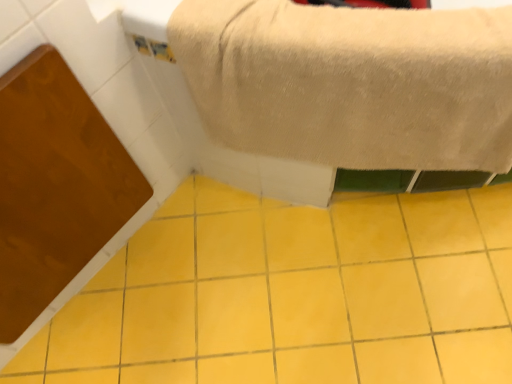
The width and height of the screenshot is (512, 384). Describe the element at coordinates (351, 82) in the screenshot. I see `beige plush towel at upper center` at that location.

Find the location of a particular element. The width and height of the screenshot is (512, 384). beige plush towel at upper center is located at coordinates (351, 82).

Describe the element at coordinates (293, 294) in the screenshot. I see `yellow ceramic tile at center` at that location.

Locate an element on the screen. Image resolution: width=512 pixels, height=384 pixels. yellow ceramic tile at center is located at coordinates [293, 294].

Where is `beige plush towel at upper center`? beige plush towel at upper center is located at coordinates (351, 82).

Is beige plush towel at upper center to the right of yellow ceramic tile at center from the viewer's perspective?

Indeed, beige plush towel at upper center is positioned on the right side of yellow ceramic tile at center.

Does beige plush towel at upper center come in front of yellow ceramic tile at center?

That is True.

Considering the positions of points (181, 48) and (175, 229), is point (181, 48) farther from camera compared to point (175, 229)?

That is False.

From the picture: From the image's perspective, which is below, beige plush towel at upper center or yellow ceramic tile at center?

yellow ceramic tile at center is shown below in the image.

From a real-world perspective, does beige plush towel at upper center sit lower than yellow ceramic tile at center?

Actually, beige plush towel at upper center is physically above yellow ceramic tile at center in the real world.

Considering the sizes of objects beige plush towel at upper center and yellow ceramic tile at center in the image provided, who is thinner, beige plush towel at upper center or yellow ceramic tile at center?

→ beige plush towel at upper center is thinner.

Considering the sizes of objects beige plush towel at upper center and yellow ceramic tile at center in the image provided, who is taller, beige plush towel at upper center or yellow ceramic tile at center?

beige plush towel at upper center.

From the picture: In terms of size, does beige plush towel at upper center appear bigger or smaller than yellow ceramic tile at center?

beige plush towel at upper center is bigger than yellow ceramic tile at center.

Is beige plush towel at upper center positioned beyond the bounds of yellow ceramic tile at center?

Yes, beige plush towel at upper center is located beyond the bounds of yellow ceramic tile at center.

Are beige plush towel at upper center and yellow ceramic tile at center located far from each other?

beige plush towel at upper center is near yellow ceramic tile at center, not far away.

Is beige plush towel at upper center turned away from yellow ceramic tile at center?

No, beige plush towel at upper center is not facing away from yellow ceramic tile at center.

You are a GUI agent. You are given a task and a screenshot of the screen. Output one action in this format:
    pyautogui.click(x=<x>, y=<y>)
    Task: Click on the towel on the right of yellow ceramic tile at center
    The image size is (512, 384).
    Given the screenshot: What is the action you would take?
    pyautogui.click(x=351, y=82)

Is yellow ceramic tile at center to the left of beige plush towel at upper center from the viewer's perspective?

Indeed, yellow ceramic tile at center is positioned on the left side of beige plush towel at upper center.

From the picture: Between yellow ceramic tile at center and beige plush towel at upper center, which one is positioned in front?

beige plush towel at upper center is closer to the camera.

Does point (244, 361) come closer to viewer compared to point (365, 84)?

No.

From the image's perspective, which one is positioned higher, yellow ceramic tile at center or beige plush towel at upper center?

beige plush towel at upper center.

From a real-world perspective, relative to beige plush towel at upper center, is yellow ceramic tile at center vertically above or below?

From a real-world perspective, yellow ceramic tile at center is physically below beige plush towel at upper center.

In terms of width, does yellow ceramic tile at center look wider or thinner when compared to beige plush towel at upper center?

yellow ceramic tile at center is wider than beige plush towel at upper center.

Considering the sizes of objects yellow ceramic tile at center and beige plush towel at upper center in the image provided, who is shorter, yellow ceramic tile at center or beige plush towel at upper center?

yellow ceramic tile at center.

Which of these two, yellow ceramic tile at center or beige plush towel at upper center, is smaller?

With smaller size is yellow ceramic tile at center.

Based on the photo, is beige plush towel at upper center surrounded by yellow ceramic tile at center?

Actually, beige plush towel at upper center is outside yellow ceramic tile at center.

Is yellow ceramic tile at center positioned far away from beige plush towel at upper center?

Actually, yellow ceramic tile at center and beige plush towel at upper center are a little close together.

From the picture: Is yellow ceramic tile at center oriented away from beige plush towel at upper center?

That's not correct — yellow ceramic tile at center is not looking away from beige plush towel at upper center.

How far apart are yellow ceramic tile at center and beige plush towel at upper center?

yellow ceramic tile at center is 18.91 inches from beige plush towel at upper center.

You are a GUI agent. You are given a task and a screenshot of the screen. Output one action in this format:
    pyautogui.click(x=<x>, y=<y>)
    Task: Click on the ceramic tile below the beige plush towel at upper center (from a real-world perspective)
    
    Given the screenshot: What is the action you would take?
    pyautogui.click(x=293, y=294)

Where is `ceramic tile directly beneath the beige plush towel at upper center (from a real-world perspective)`? ceramic tile directly beneath the beige plush towel at upper center (from a real-world perspective) is located at coordinates (293, 294).

I want to click on ceramic tile behind the beige plush towel at upper center, so click(293, 294).